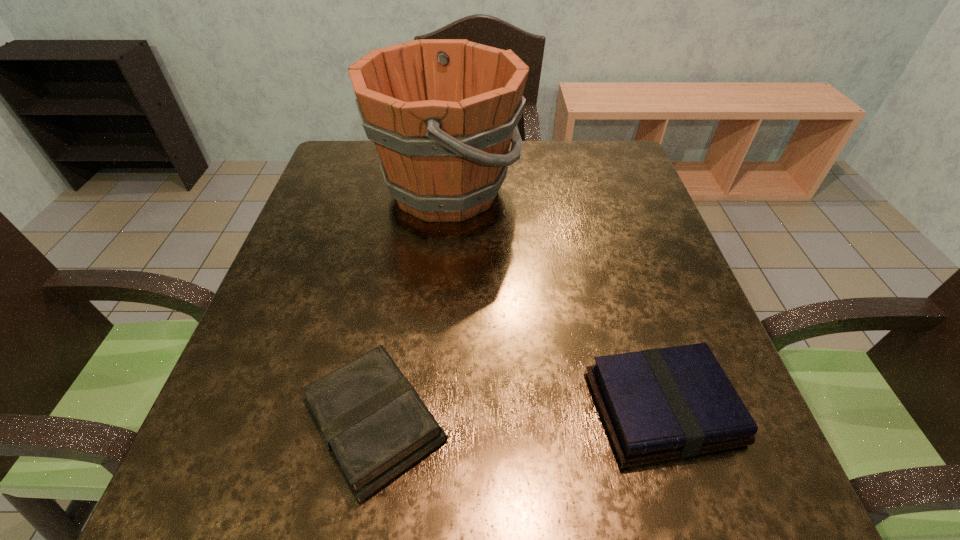
The height and width of the screenshot is (540, 960). Find the location of `free space between the left book and the right book`. free space between the left book and the right book is located at coordinates pos(518,416).

Find the location of a particular element. The width and height of the screenshot is (960, 540). free space between the farthest object and the right book is located at coordinates (554, 300).

At what (x,y) coordinates should I click in order to perform the action: click on vacant space that's between the left book and the tallest object. Please return your answer as a coordinate pair (x, y). The image size is (960, 540). Looking at the image, I should click on (411, 307).

At what (x,y) coordinates should I click in order to perform the action: click on empty space that is in between the right book and the left book. Please return your answer as a coordinate pair (x, y). The height and width of the screenshot is (540, 960). Looking at the image, I should click on (518, 416).

You are a GUI agent. You are given a task and a screenshot of the screen. Output one action in this format:
    pyautogui.click(x=<x>, y=<y>)
    Task: Click on the empty location between the tallest object and the left book
    This screenshot has height=540, width=960.
    Given the screenshot: What is the action you would take?
    pyautogui.click(x=411, y=307)

In order to click on free space between the rightmost object and the left book in this screenshot , I will do `click(518, 416)`.

The height and width of the screenshot is (540, 960). What are the coordinates of `free spot between the farthest object and the rightmost object` in the screenshot? It's located at [x=554, y=300].

Where is `vacant area that lies between the rightmost object and the farthest object`? This screenshot has width=960, height=540. vacant area that lies between the rightmost object and the farthest object is located at coordinates (554, 300).

Locate an element on the screen. Image resolution: width=960 pixels, height=540 pixels. free spot between the rightmost object and the tallest object is located at coordinates (554, 300).

Find the location of a particular element. The width and height of the screenshot is (960, 540). empty location between the right book and the farthest object is located at coordinates (554, 300).